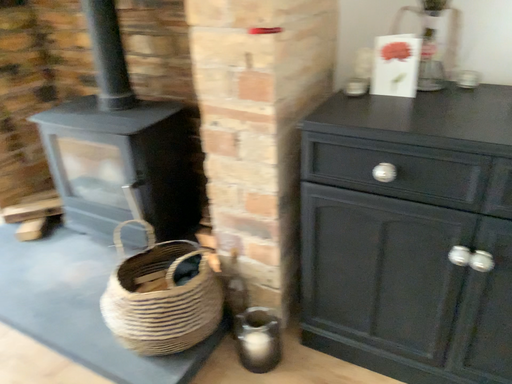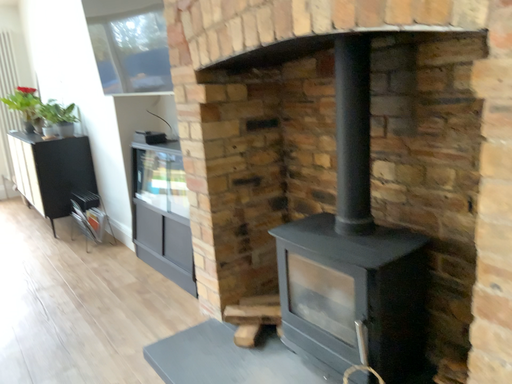
Question: Which way did the camera rotate in the video?

Choices:
 (A) rotated upward
 (B) rotated downward

Answer: (A)